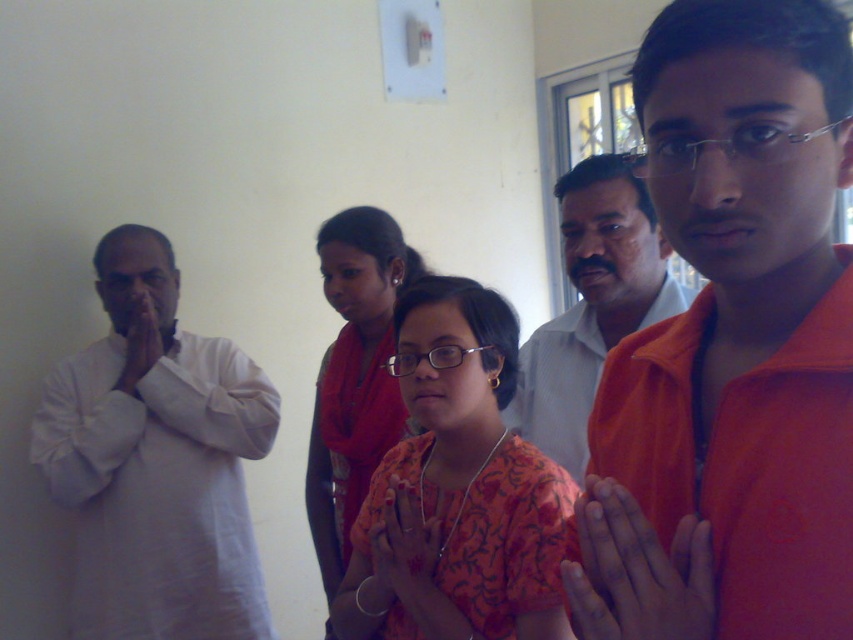
You are organizing a clothing donation drive and need to determine which of the two shirts, the orange cotton shirt at center or the matte white shirt at center, can fit into a storage box that has a width capacity of 40 cm. Given their sizes, which shirt is more likely to fit?

The orange cotton shirt at center has a smaller width than the matte white shirt at center, so it is more likely to fit into the 40 cm width storage box.

Based on the scene description, can you determine which clothing item, the orange cotton shirt at center or the white cotton kurta at left, is positioned higher in the image?

The orange cotton shirt at center is positioned higher than the white cotton kurta at left in the image.